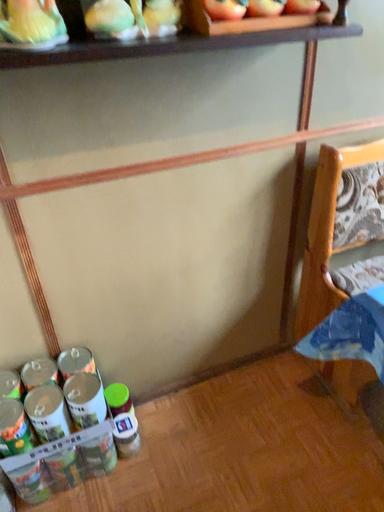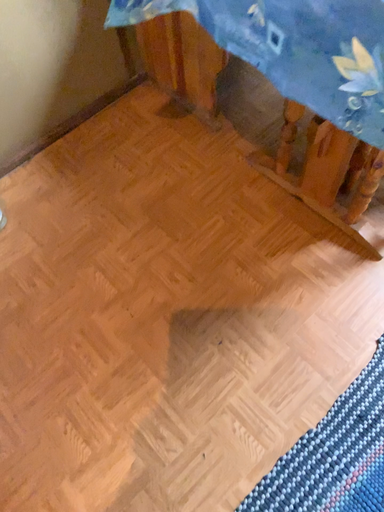
Question: Which way did the camera rotate in the video?

Choices:
 (A) rotated right
 (B) rotated left

Answer: (A)